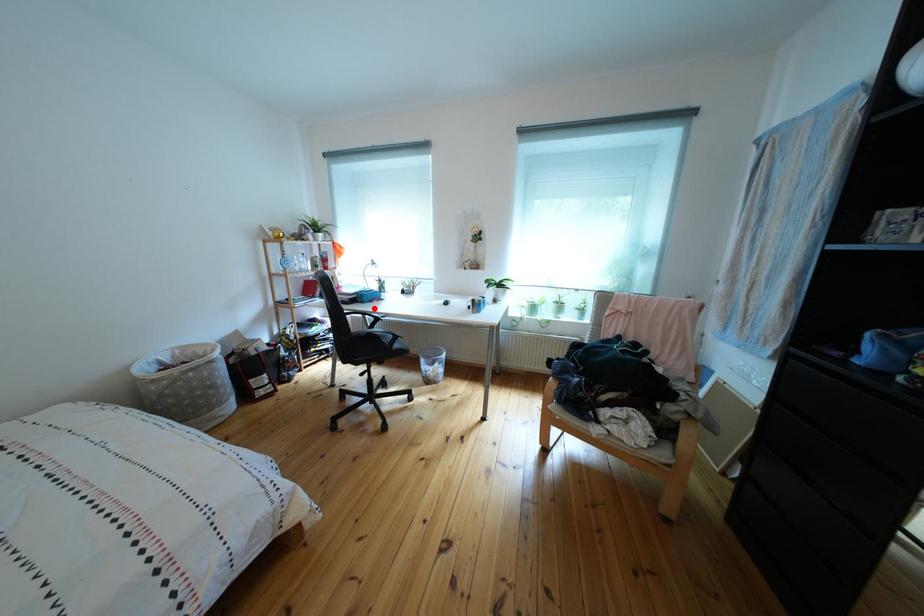
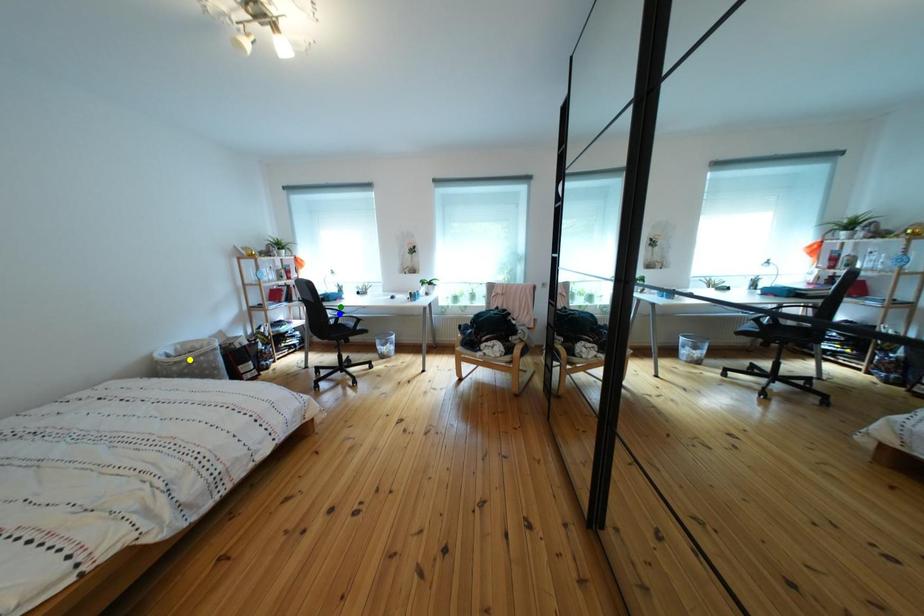
Question: I am providing you with two images of the same scene from different viewpoints. A red point is marked on the first image. You are given multiple points on the second image. Which point in image 2 is actually the same real-world point as the red point in image 1?

Choices:
 (A) yellow point
 (B) green point
 (C) blue point

Answer: (B)